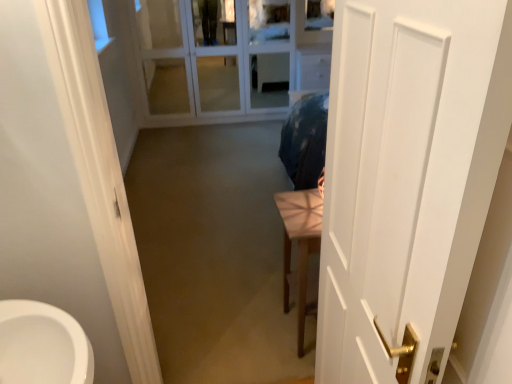
Question: Should I look upward or downward to see white glass door at upper center?

Choices:
 (A) down
 (B) up

Answer: (B)

Question: Does white matte door at right have a lesser width compared to white glass door at upper center?

Choices:
 (A) no
 (B) yes

Answer: (B)

Question: From a real-world perspective, is white matte door at right under white glass door at upper center?

Choices:
 (A) yes
 (B) no

Answer: (B)

Question: Does white matte door at right have a larger size compared to white glass door at upper center?

Choices:
 (A) yes
 (B) no

Answer: (B)

Question: Is white matte door at right far away from white glass door at upper center?

Choices:
 (A) yes
 (B) no

Answer: (A)

Question: Is white matte door at right not inside white glass door at upper center?

Choices:
 (A) yes
 (B) no

Answer: (A)

Question: Is white matte door at right further to camera compared to white glass door at upper center?

Choices:
 (A) yes
 (B) no

Answer: (B)

Question: From a real-world perspective, does light brown wooden table at center sit lower than white matte door at right?

Choices:
 (A) yes
 (B) no

Answer: (A)

Question: Can you confirm if light brown wooden table at center is thinner than white matte door at right?

Choices:
 (A) yes
 (B) no

Answer: (B)

Question: Does light brown wooden table at center appear on the left side of white matte door at right?

Choices:
 (A) no
 (B) yes

Answer: (B)

Question: Is light brown wooden table at center completely or partially outside of white matte door at right?

Choices:
 (A) yes
 (B) no

Answer: (A)

Question: From the image's perspective, is light brown wooden table at center under white matte door at right?

Choices:
 (A) no
 (B) yes

Answer: (B)

Question: Is light brown wooden table at center far from white matte door at right?

Choices:
 (A) yes
 (B) no

Answer: (B)

Question: Does white matte door at right have a lesser height compared to light brown wooden table at center?

Choices:
 (A) no
 (B) yes

Answer: (A)